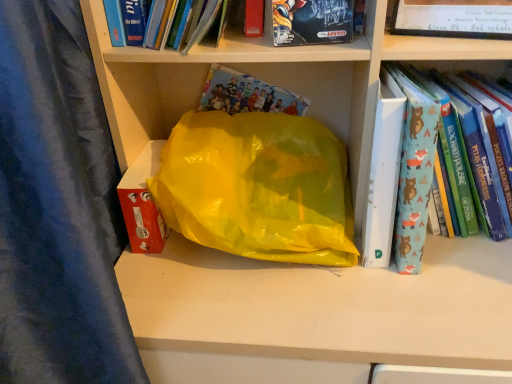
Question: Would you say blue fabric book at right, marked as the 1th book in a right-to-left arrangement, is to the left or to the right of hardcover book at upper center, the third book from the right, in the picture?

Choices:
 (A) left
 (B) right

Answer: (B)

Question: In terms of size, does blue fabric book at right, marked as the 1th book in a right-to-left arrangement, appear bigger or smaller than hardcover book at upper center, the third book from the right?

Choices:
 (A) big
 (B) small

Answer: (A)

Question: Estimate the real-world distances between objects in this image. Which object is farther from the hardcover book at upper center, the first book when ordered from left to right?

Choices:
 (A) matt black board game at upper center, the 2th book from the left
 (B) blue fabric book at right, marked as the 1th book in a right-to-left arrangement

Answer: (B)

Question: Which is farther from the blue fabric book at right, which appears as the third book when viewed from the left?

Choices:
 (A) matt black board game at upper center, which is the second book from right to left
 (B) hardcover book at upper center, the third book from the right

Answer: (B)